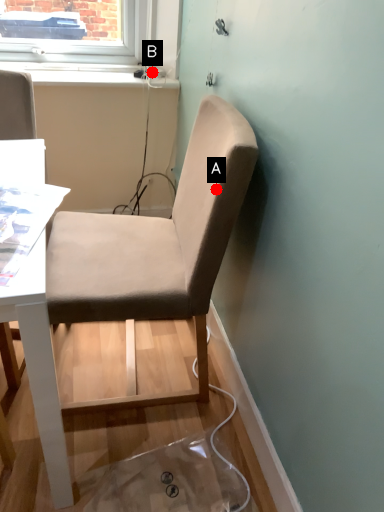
Question: Two points are circled on the image, labeled by A and B beside each circle. Which point appears farthest from the camera in this image?

Choices:
 (A) A is further
 (B) B is further

Answer: (B)